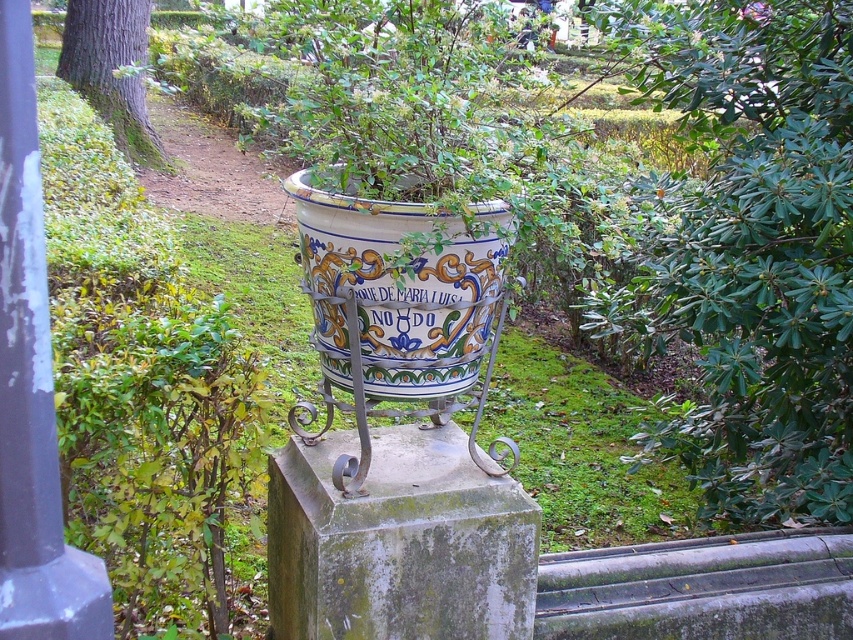
You are standing in a garden and see the green leafy bush at upper right and the brown rough bark at upper left. Which object is positioned lower in the image?

The green leafy bush at upper right is positioned below the brown rough bark at upper left, so the green leafy bush at upper right is lower.

You are standing at the center of the garden and want to place a new decorative item at the same location as the green leafy bush at upper right. What are the coordinates of that location?

The coordinates of the location where the green leafy bush at upper right is positioned are at point (758, 250).